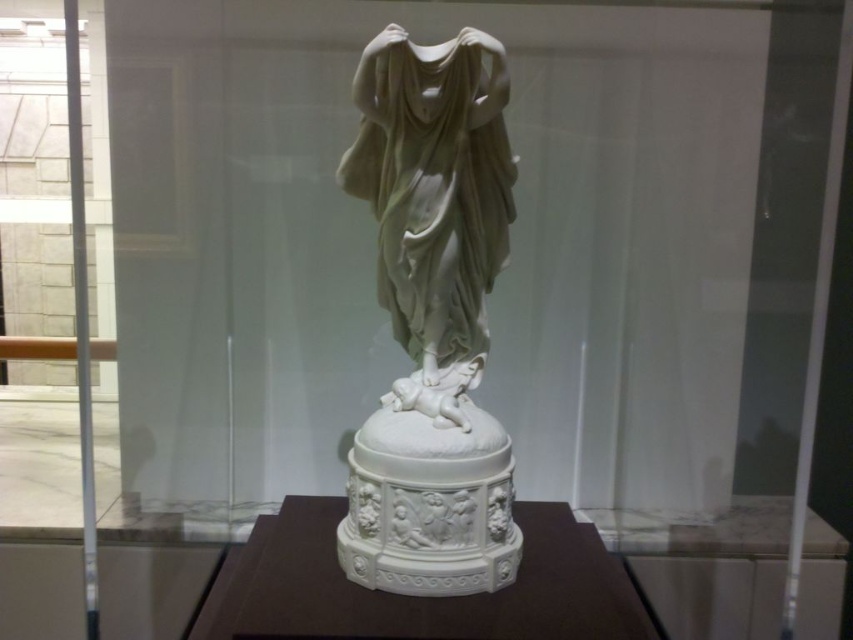
Question: Which point appears farthest from the camera in this image?

Choices:
 (A) click(x=219, y=586)
 (B) click(x=376, y=474)

Answer: (A)

Question: From the image, what is the correct spatial relationship of white marble statue at center in relation to white marble base at center?

Choices:
 (A) right
 (B) left

Answer: (B)

Question: Is white marble statue at center thinner than white marble base at center?

Choices:
 (A) no
 (B) yes

Answer: (B)

Question: Does white marble statue at center lie in front of white marble base at center?

Choices:
 (A) yes
 (B) no

Answer: (B)